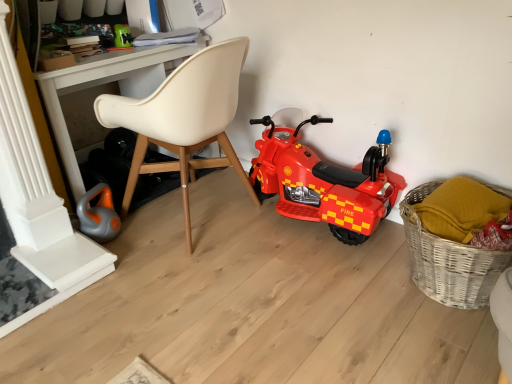
Question: Considering the relative sizes of green plastic toy at upper left, arranged as the first toy when viewed from the back, and beige leather chair at center in the image provided, is green plastic toy at upper left, arranged as the first toy when viewed from the back, bigger than beige leather chair at center?

Choices:
 (A) no
 (B) yes

Answer: (A)

Question: Is the depth of green plastic toy at upper left, arranged as the first toy when viewed from the back, greater than that of beige leather chair at center?

Choices:
 (A) no
 (B) yes

Answer: (B)

Question: Is green plastic toy at upper left, the 2th toy ordered from the bottom, thinner than beige leather chair at center?

Choices:
 (A) no
 (B) yes

Answer: (B)

Question: Is green plastic toy at upper left, which ranks as the second toy in front-to-back order, oriented away from beige leather chair at center?

Choices:
 (A) yes
 (B) no

Answer: (B)

Question: Is there a large distance between green plastic toy at upper left, which ranks as the second toy in front-to-back order, and beige leather chair at center?

Choices:
 (A) no
 (B) yes

Answer: (A)

Question: Is green plastic toy at upper left, arranged as the first toy when viewed from the back, closer to camera compared to beige leather chair at center?

Choices:
 (A) yes
 (B) no

Answer: (B)

Question: Considering the relative sizes of beige leather chair at center and white plastic desk at upper center in the image provided, is beige leather chair at center smaller than white plastic desk at upper center?

Choices:
 (A) no
 (B) yes

Answer: (B)

Question: From the image's perspective, is beige leather chair at center on top of white plastic desk at upper center?

Choices:
 (A) no
 (B) yes

Answer: (A)

Question: From the image's perspective, is beige leather chair at center under white plastic desk at upper center?

Choices:
 (A) no
 (B) yes

Answer: (B)

Question: Does beige leather chair at center have a larger size compared to white plastic desk at upper center?

Choices:
 (A) yes
 (B) no

Answer: (B)

Question: Does beige leather chair at center appear on the left side of white plastic desk at upper center?

Choices:
 (A) no
 (B) yes

Answer: (A)

Question: Is beige leather chair at center thinner than white plastic desk at upper center?

Choices:
 (A) no
 (B) yes

Answer: (A)

Question: Considering the relative positions of red plastic toy motorcycle at center and white plastic desk at upper center in the image provided, is red plastic toy motorcycle at center in front of white plastic desk at upper center?

Choices:
 (A) no
 (B) yes

Answer: (B)